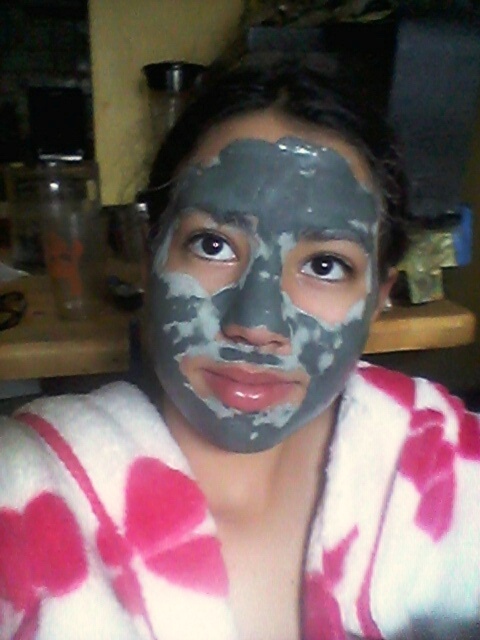
Consider the image. You are planning to place a decorative item on a shelf that can only hold items wider than the gray clay mask at center. Do you think the white fuzzy bathrobe at center would fit on the shelf?

The white fuzzy bathrobe at center is wider than the gray clay mask at center, so it would fit on the shelf since its width exceeds the required minimum.

You are a home assistant and need to place a new decorative item on the wooden countertop. The item is 1.2 meters tall. Looking at the scene, can you determine if there is enough vertical space between the white fuzzy bathrobe at center and the gray clay mask at center to fit this item?

The white fuzzy bathrobe at center is much taller than the gray clay mask at center. Since the new item is 1.2 meters tall, it may not fit vertically between them unless there is sufficient height difference. However, without specific measurements of their heights, it is impossible to confirm if the space is adequate.